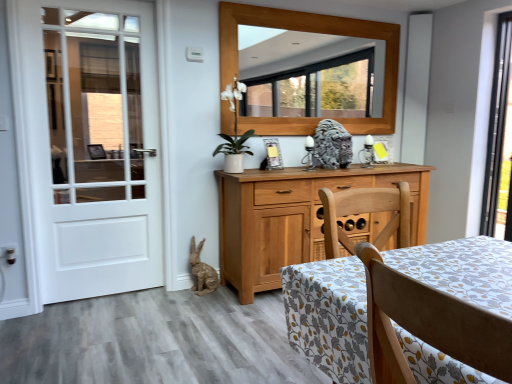
Question: In terms of width, does light brown wood chair at lower right look wider or thinner when compared to white wooden door at left?

Choices:
 (A) thin
 (B) wide

Answer: (B)

Question: Considering their positions, is light brown wood chair at lower right located in front of or behind white wooden door at left?

Choices:
 (A) front
 (B) behind

Answer: (A)

Question: Which of these objects is positioned closest to the matte wooden picture frame at center?

Choices:
 (A) light brown wood chair at lower right
 (B) white wooden door at left
 (C) wooden frame at upper center
 (D) burlap-textured rabbit at lower left, acting as the 1th animal starting from the bottom
 (E) gray stone lion at center, the 1th animal positioned from the right

Answer: (E)

Question: Estimate the real-world distances between objects in this image. Which object is closer to the light brown wood chair at lower right?

Choices:
 (A) wooden frame at upper center
 (B) matte wooden picture frame at center
 (C) burlap-textured rabbit at lower left, arranged as the first animal when viewed from the left
 (D) gray stone lion at center, positioned as the 2th animal in bottom-to-top order
 (E) white wooden door at left

Answer: (B)